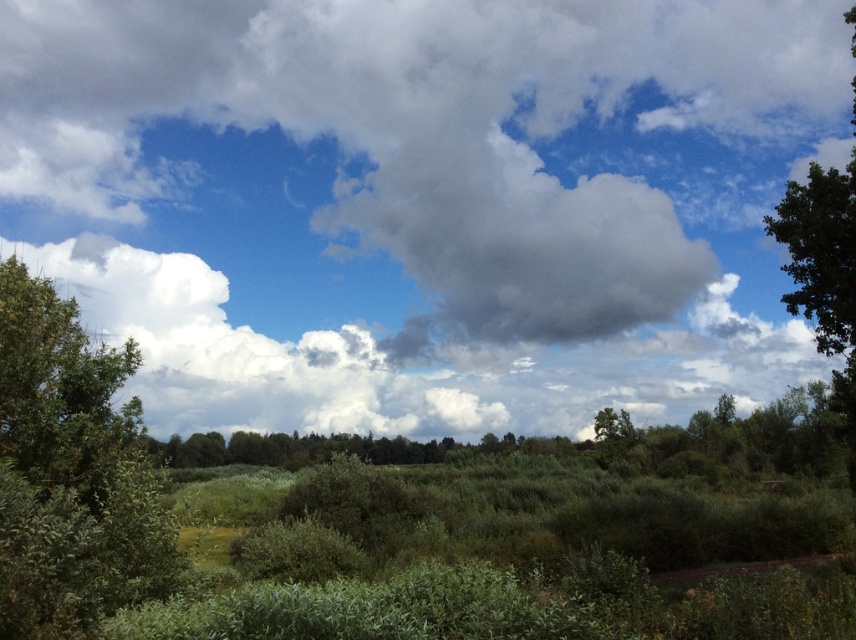
You are standing in the serene natural landscape described. You want to take a photo of the white fluffy cloud at upper center using a camera that has a maximum zoom range of 100 meters. Can you capture the cloud in full detail without moving closer?

The white fluffy cloud at upper center and camera are 138.81 meters apart from each other. Since the camera can only zoom up to 100 meters, you cannot capture the cloud in full detail without moving closer.